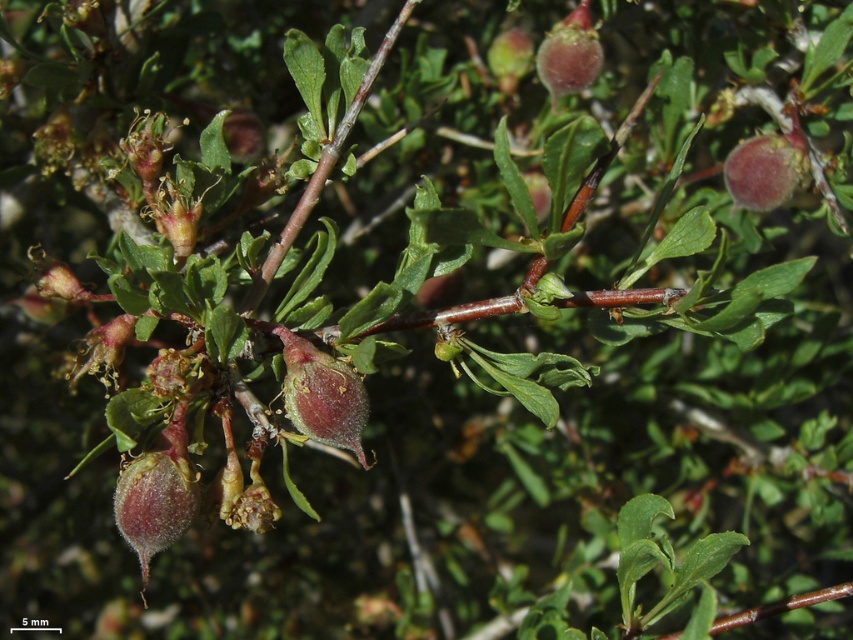
Question: From the image, what is the correct spatial relationship of pinkish-red glossy berry at center in relation to glossy red fruit at upper center?

Choices:
 (A) below
 (B) above

Answer: (A)

Question: Is pinkish-red glossy berry at upper right positioned before glossy red fruit at upper center?

Choices:
 (A) yes
 (B) no

Answer: (A)

Question: Based on their relative distances, which object is nearer to the pinkish-red glossy berry at upper right?

Choices:
 (A) pinkish-red glossy berry at center
 (B) glossy red fruit at upper center

Answer: (B)

Question: Which point is farther from the camera taking this photo?

Choices:
 (A) (283, 348)
 (B) (566, 56)
 (C) (761, 202)

Answer: (B)

Question: In this image, where is pinkish-red glossy berry at center located relative to glossy red fruit at upper center?

Choices:
 (A) below
 (B) above

Answer: (A)

Question: Which point is closer to the camera?

Choices:
 (A) (556, 83)
 (B) (317, 352)

Answer: (B)